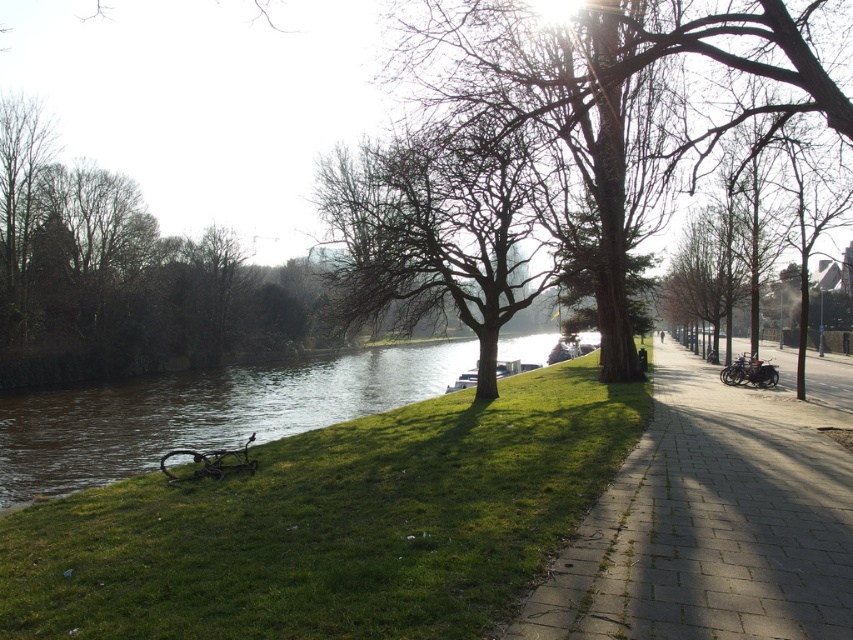
Between smooth bark tree at center and bare wood tree at center, which one appears on the left side from the viewer's perspective?

From the viewer's perspective, bare wood tree at center appears more on the left side.

Can you confirm if smooth bark tree at center is wider than bare wood tree at center?

Yes.

This screenshot has width=853, height=640. I want to click on smooth bark tree at center, so click(x=622, y=88).

Find the location of `smooth bark tree at center`. smooth bark tree at center is located at coordinates (622, 88).

Does green grass at lower left have a smaller size compared to paved stone sidewalk at center?

Indeed, green grass at lower left has a smaller size compared to paved stone sidewalk at center.

The image size is (853, 640). Find the location of `green grass at lower left`. green grass at lower left is located at coordinates (334, 524).

Is smooth bark tree at center bigger than brown leafless tree at left?

Actually, smooth bark tree at center might be smaller than brown leafless tree at left.

Does smooth bark tree at center have a smaller size compared to brown leafless tree at left?

Indeed, smooth bark tree at center has a smaller size compared to brown leafless tree at left.

Which is in front, point (828, 100) or point (287, 344)?

Point (828, 100)

At what (x,y) coordinates should I click in order to perform the action: click on smooth bark tree at center. Please return your answer as a coordinate pair (x, y). Looking at the image, I should click on (622, 88).